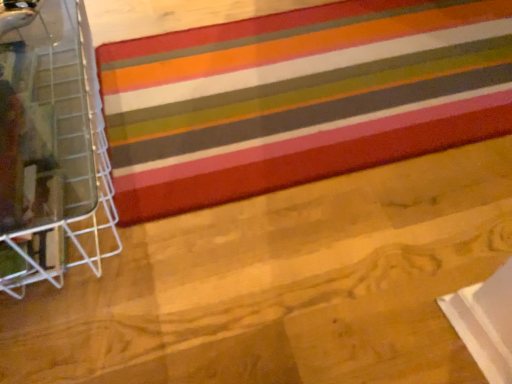
Question: Is clear plastic basket at left positioned far away from multicolored striped rug at center?

Choices:
 (A) no
 (B) yes

Answer: (A)

Question: Is clear plastic basket at left wider than multicolored striped rug at center?

Choices:
 (A) yes
 (B) no

Answer: (B)

Question: Does clear plastic basket at left touch multicolored striped rug at center?

Choices:
 (A) yes
 (B) no

Answer: (B)

Question: Is clear plastic basket at left at the left side of multicolored striped rug at center?

Choices:
 (A) yes
 (B) no

Answer: (A)

Question: Is clear plastic basket at left aimed at multicolored striped rug at center?

Choices:
 (A) yes
 (B) no

Answer: (A)

Question: Considering the relative sizes of clear plastic basket at left and multicolored striped rug at center in the image provided, is clear plastic basket at left shorter than multicolored striped rug at center?

Choices:
 (A) no
 (B) yes

Answer: (A)

Question: Is multicolored striped rug at center located outside clear plastic basket at left?

Choices:
 (A) no
 (B) yes

Answer: (B)

Question: Does multicolored striped rug at center have a greater width compared to clear plastic basket at left?

Choices:
 (A) no
 (B) yes

Answer: (B)

Question: Is multicolored striped rug at center smaller than clear plastic basket at left?

Choices:
 (A) no
 (B) yes

Answer: (B)

Question: Is there a large distance between multicolored striped rug at center and clear plastic basket at left?

Choices:
 (A) no
 (B) yes

Answer: (A)

Question: Can you see multicolored striped rug at center touching clear plastic basket at left?

Choices:
 (A) no
 (B) yes

Answer: (A)

Question: Is multicolored striped rug at center shorter than clear plastic basket at left?

Choices:
 (A) no
 (B) yes

Answer: (B)

Question: Is point (52, 119) positioned closer to the camera than point (267, 62)?

Choices:
 (A) closer
 (B) farther

Answer: (A)